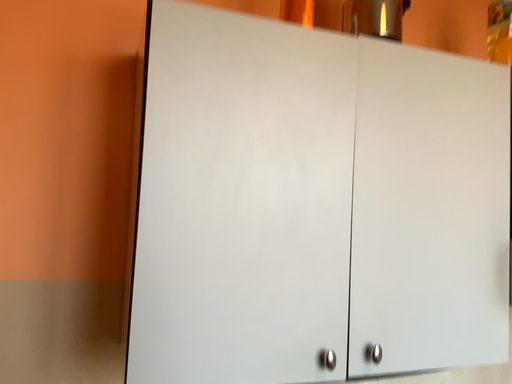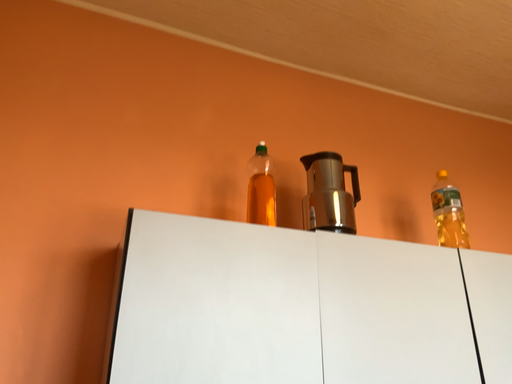
Question: Which way did the camera rotate in the video?

Choices:
 (A) rotated upward
 (B) rotated downward

Answer: (A)